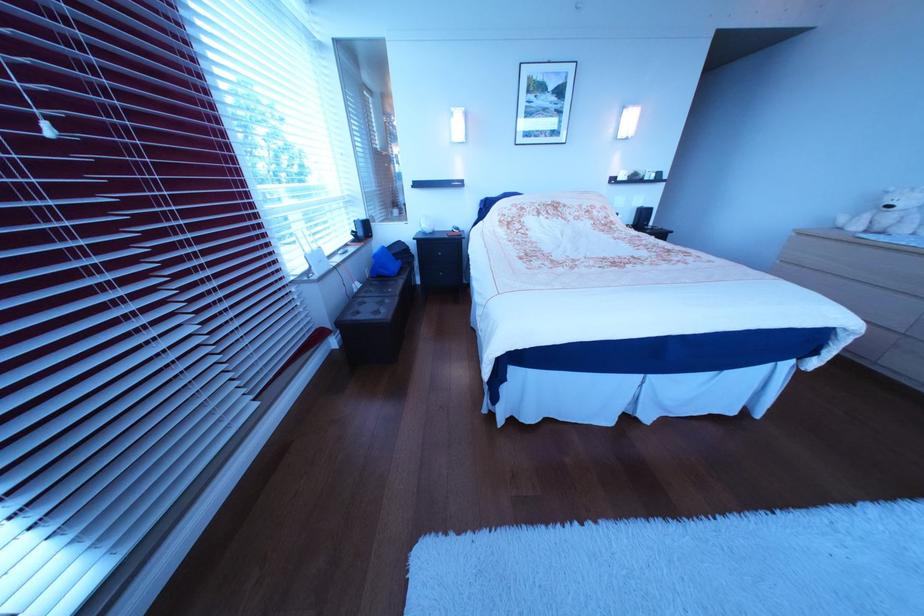
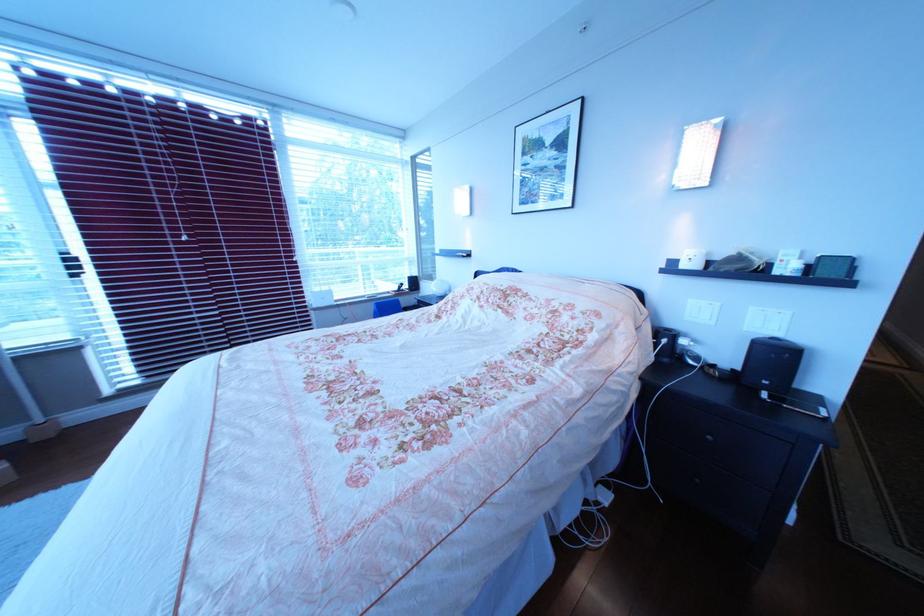
The point at (634,180) is marked in the first image. Where is the corresponding point in the second image?

(699, 267)